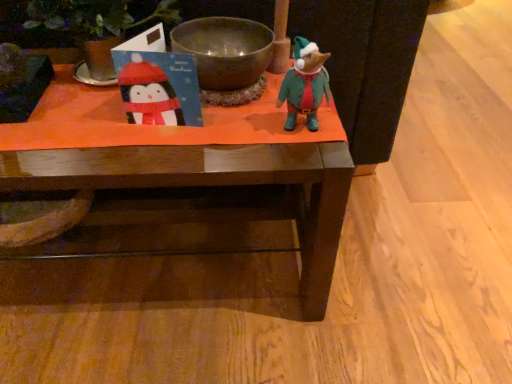
This screenshot has height=384, width=512. I want to click on vacant space in wooden table at center (from a real-world perspective), so click(182, 268).